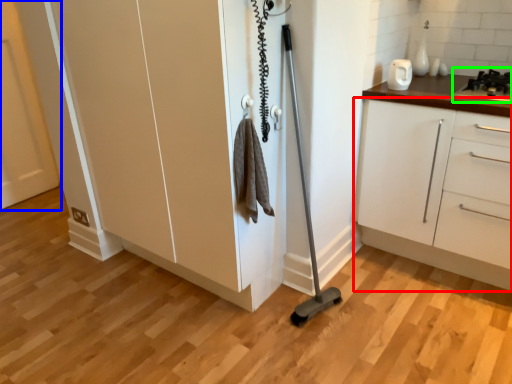
Question: Estimate the real-world distances between objects in this image. Which object is farther from cabinetry (highlighted by a red box), door (highlighted by a blue box) or gas stove (highlighted by a green box)?

Choices:
 (A) door
 (B) gas stove

Answer: (A)